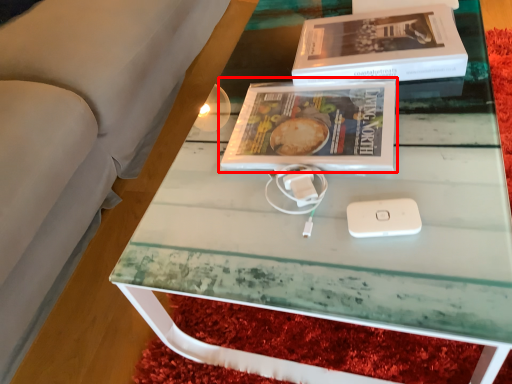
Question: From the image's perspective, where is book (annotated by the red box) located relative to box?

Choices:
 (A) below
 (B) above

Answer: (A)